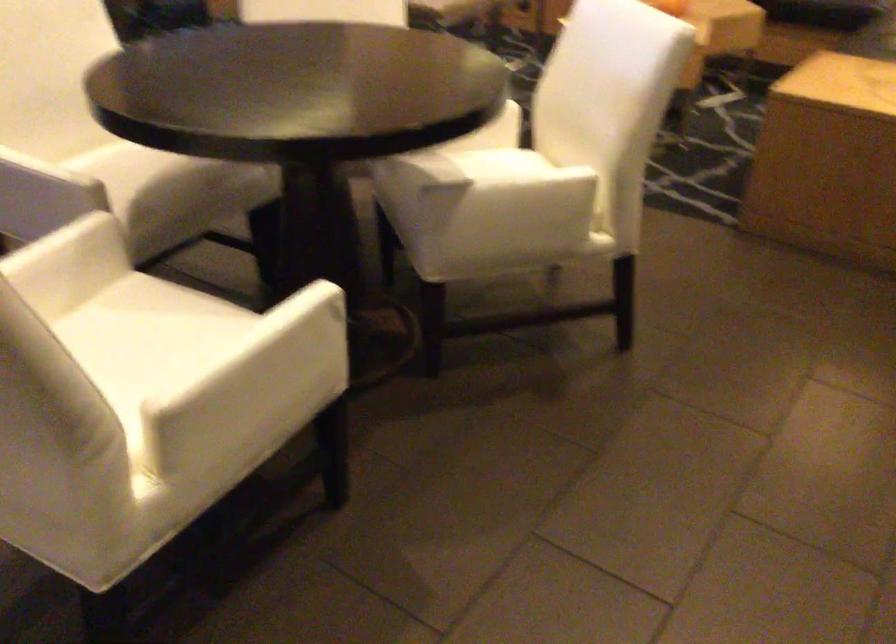
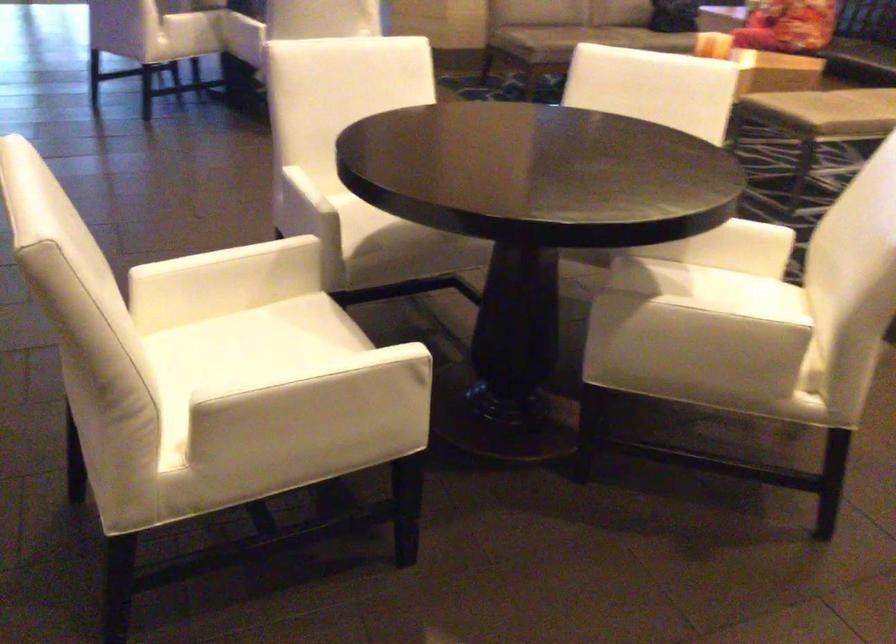
The point at (x=121, y=336) is marked in the first image. Where is the corresponding point in the second image?

(259, 339)